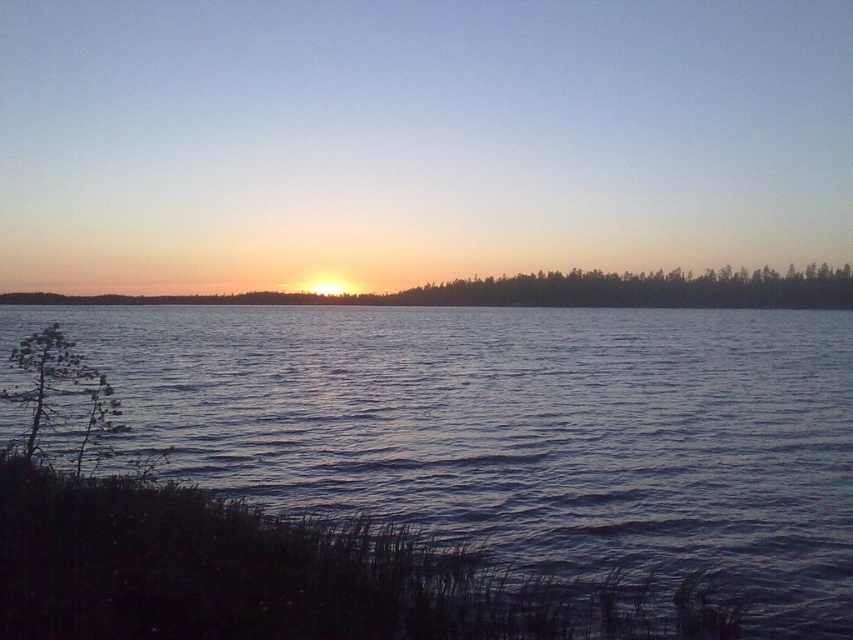
You are standing on the lakeside and want to take a photo of the orange sky at horizon and the dark blue water at center. Which object should you frame first in your camera to capture both in the same shot?

You should frame the orange sky at horizon first because it is located to the left of the dark blue water at center, so positioning the camera to include both requires starting from the left side where the orange sky at horizon is positioned.

You are an artist trying to paint this lakeside scene. You want to ensure the dark blue water at center and the green matte tree at lower left are proportionally accurate. Which object should you paint first to maintain the correct size relationship between them?

The dark blue water at center should be painted first since it has a larger size compared to the green matte tree at lower left, ensuring the proportions are maintained when adding the smaller tree later.

Based on the scene, which object occupies a larger portion of the image, the orange sky at horizon or the dark blue water at center?

The orange sky at horizon is wider than the dark blue water at center, so the orange sky at horizon occupies a larger portion of the image.